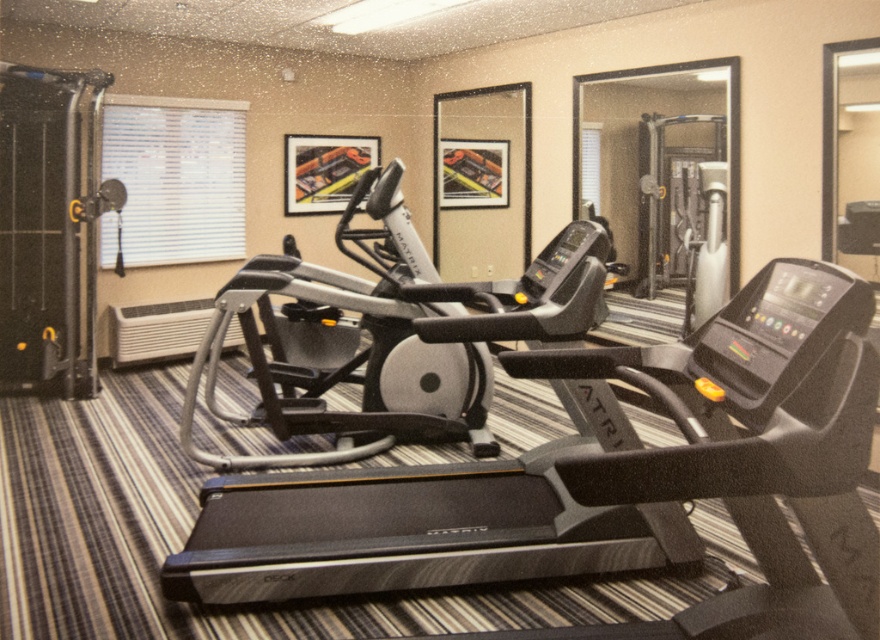
Does black plastic treadmill at center have a smaller size compared to silver metallic elliptical trainer at center?

Indeed, black plastic treadmill at center has a smaller size compared to silver metallic elliptical trainer at center.

Who is more distant from viewer, (852, 476) or (235, 460)?

Positioned behind is point (235, 460).

At what (x,y) coordinates should I click in order to perform the action: click on black plastic treadmill at center. Please return your answer as a coordinate pair (x, y). This screenshot has width=880, height=640. Looking at the image, I should click on (606, 481).